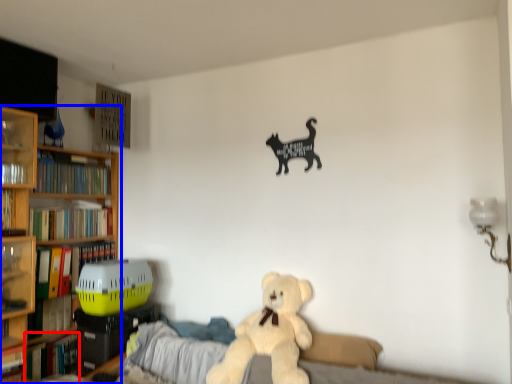
Question: Among these objects, which one is nearest to the camera, book (highlighted by a red box) or bookcase (highlighted by a blue box)?

Choices:
 (A) book
 (B) bookcase

Answer: (B)